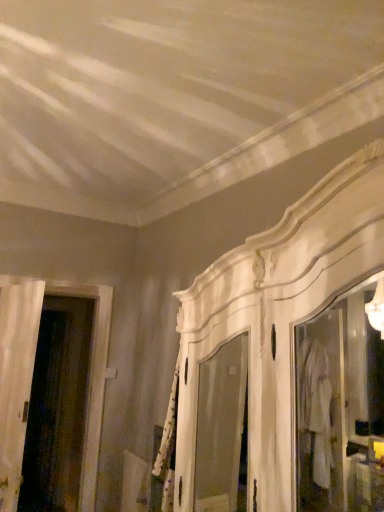
Where is `white wood door at left`? The image size is (384, 512). white wood door at left is located at coordinates (16, 376).

Describe the element at coordinates (16, 376) in the screenshot. I see `white wood door at left` at that location.

The image size is (384, 512). I want to click on transparent glass screen door at left, so click(x=58, y=407).

What do you see at coordinates (58, 407) in the screenshot? The image size is (384, 512). I see `transparent glass screen door at left` at bounding box center [58, 407].

Identify the location of white wood door at left. (x=16, y=376).

Consider the image. Does white wood door at left appear on the right side of transparent glass screen door at left?

Yes, white wood door at left is to the right of transparent glass screen door at left.

Relative to transparent glass screen door at left, is white wood door at left in front or behind?

In the image, white wood door at left appears in front of transparent glass screen door at left.

Considering the positions of point (11, 444) and point (69, 461), is point (11, 444) closer or farther from the camera than point (69, 461)?

Point (11, 444) is positioned closer to the camera compared to point (69, 461).

From the image's perspective, who appears lower, white wood door at left or transparent glass screen door at left?

transparent glass screen door at left is shown below in the image.

From a real-world perspective, is white wood door at left physically located above or below transparent glass screen door at left?

From a real-world perspective, white wood door at left is physically above transparent glass screen door at left.

Looking at their sizes, would you say white wood door at left is wider or thinner than transparent glass screen door at left?

Clearly, white wood door at left has less width compared to transparent glass screen door at left.

Which of these two, white wood door at left or transparent glass screen door at left, stands shorter?

With less height is white wood door at left.

In terms of size, does white wood door at left appear bigger or smaller than transparent glass screen door at left?

Considering their sizes, white wood door at left takes up less space than transparent glass screen door at left.

Which is correct: white wood door at left is inside transparent glass screen door at left, or outside of it?

white wood door at left is located beyond the bounds of transparent glass screen door at left.

Is the surface of white wood door at left in direct contact with transparent glass screen door at left?

No, white wood door at left is not beside transparent glass screen door at left.

Is white wood door at left facing away from transparent glass screen door at left?

white wood door at left does not have its back to transparent glass screen door at left.

You are a GUI agent. You are given a task and a screenshot of the screen. Output one action in this format:
    pyautogui.click(x=<x>, y=<y>)
    Task: Click on the screen door located behind the white wood door at left
    The width and height of the screenshot is (384, 512).
    Given the screenshot: What is the action you would take?
    pyautogui.click(x=58, y=407)

Consider the image. Between transparent glass screen door at left and white wood door at left, which one appears on the right side from the viewer's perspective?

white wood door at left is more to the right.

In the image, is transparent glass screen door at left positioned in front of or behind white wood door at left?

transparent glass screen door at left is behind white wood door at left.

Is point (54, 359) positioned behind point (9, 445)?

Yes, point (54, 359) is behind point (9, 445).

From the image's perspective, between transparent glass screen door at left and white wood door at left, which one is located above?

white wood door at left is shown above in the image.

From a real-world perspective, is transparent glass screen door at left located higher than white wood door at left?

No, from a real-world perspective, transparent glass screen door at left is not over white wood door at left

Is transparent glass screen door at left wider or thinner than white wood door at left?

transparent glass screen door at left is wider than white wood door at left.

Is transparent glass screen door at left taller than white wood door at left?

Yes, transparent glass screen door at left is taller than white wood door at left.

Between transparent glass screen door at left and white wood door at left, which one has larger size?

Bigger between the two is transparent glass screen door at left.

Would you say transparent glass screen door at left contains white wood door at left?

No, white wood door at left is not inside transparent glass screen door at left.

Would you say transparent glass screen door at left is a long distance from white wood door at left?

Absolutely, transparent glass screen door at left is distant from white wood door at left.

Is transparent glass screen door at left aimed at white wood door at left?

No, transparent glass screen door at left is not oriented towards white wood door at left.

How different are the orientations of transparent glass screen door at left and white wood door at left in degrees?

The angle between the facing direction of transparent glass screen door at left and the facing direction of white wood door at left is 98.3 degrees.

This screenshot has height=512, width=384. Identify the location of door in front of the transparent glass screen door at left. (16, 376).

The width and height of the screenshot is (384, 512). I want to click on screen door on the left of white wood door at left, so click(x=58, y=407).

I want to click on screen door that appears behind the white wood door at left, so click(58, 407).